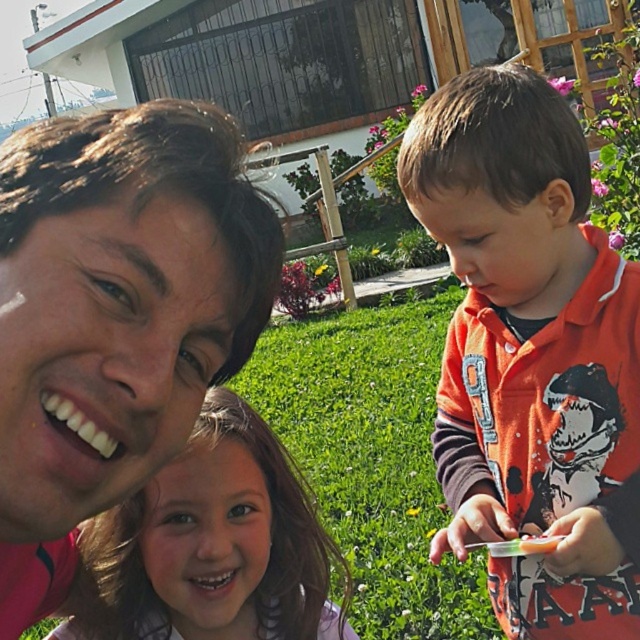
Looking at this image, you are a photographer trying to capture a candid shot of the two subjects wearing the matte pink shirt at upper left and orange fleece jacket at right. The camera you are using has a maximum focus range of 55 centimeters. Can you fit both subjects within the frame without moving the camera?

The matte pink shirt at upper left and orange fleece jacket at right are 54.94 centimeters apart from each other, so yes, the camera can focus on both subjects since the distance between them is within the 55 centimeter range.

You are a photographer trying to capture a group photo of the matte pink shirt at upper left and the orange fleece jacket at right. Since you want to ensure both subjects are in the frame, which direction should you move your camera to include both?

The matte pink shirt at upper left is positioned on the left side of the orange fleece jacket at right, so you should move your camera to the left to include both subjects in the frame.